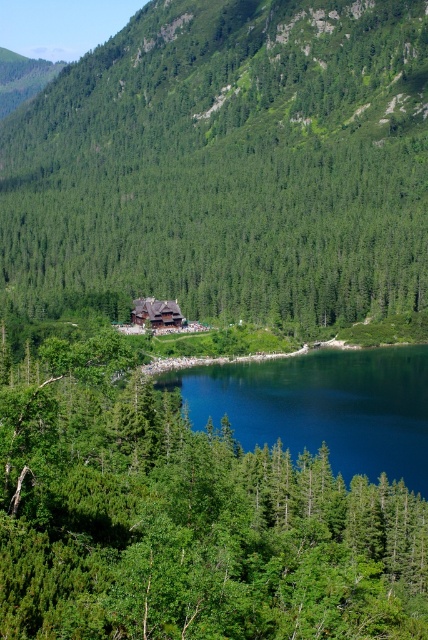
You are standing at the point with coordinates point (181, 323) and want to walk towards the point with coordinates point (262, 422). Which direction should you move relative to your current position?

You should move forward because point (262, 422) is in front of point (181, 323).

Please provide the coordinates of the green leafy tree at center in the image. The scene includes dense clusters of coniferous trees in the foreground and a small rustic building in the middle ground.

The green leafy tree at center is located at coordinates point [184,518].

You are standing in the forest and want to take a photo of both the green leafy tree at center and the deep blue water at center. Which object should you focus on first to ensure both are in clear view?

You should focus on the green leafy tree at center first because it is closer to you than the deep blue water at center, so adjusting focus from near to far will help both be in clear view.